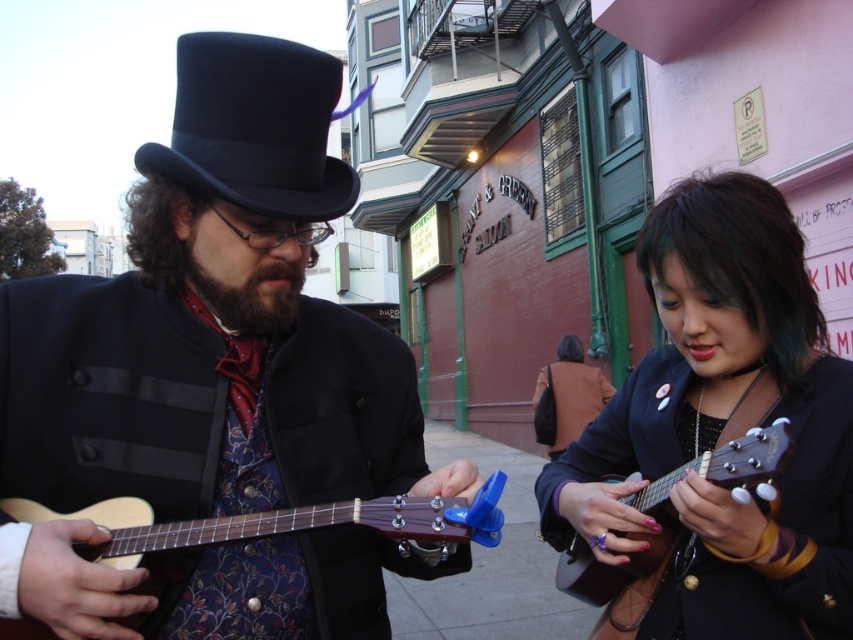
You are a photographer trying to capture a closeup of the matte black top hat at center and the brown fuzzy beard at center. Which object should you focus on first to ensure it appears sharp in the photo?

The matte black top hat at center is closer to the viewer than the brown fuzzy beard at center, so you should focus on the matte black top hat at center first to ensure it appears sharp.

You are a photographer trying to capture a closeup of the brown fuzzy beard at center and the matte black top hat at center. Based on their positions, which object is closer to the left side of your camera frame?

The brown fuzzy beard at center is closer to the left side of your camera frame because the matte black top hat at center is to the right of it.